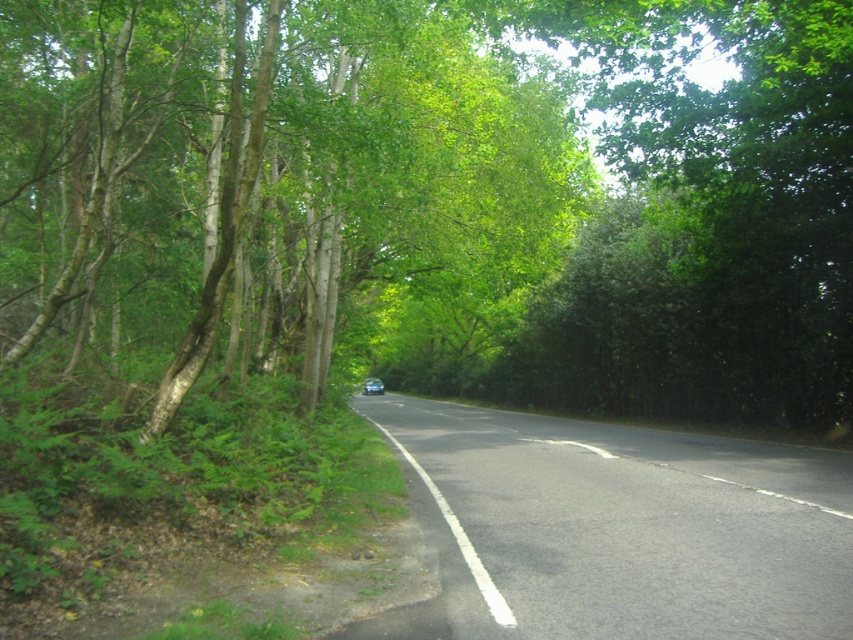
You are a pedestrian standing on the sidewalk next to the black asphalt road at center. You see a metallic blue car at center approaching from the distance. Which side of the road should you stand on to ensure safety?

The black asphalt road at center is to the right of the metallic blue car at center, so you should stand on the left side of the road to stay safe as the car approaches from the right side.

You are standing at the starting point of the road and want to reach the green leafy tree at center. Which direction should you walk to get there?

The green leafy tree at center is located at point (434,200), so you should walk towards the center of the road to reach it.

You are a pedestrian standing at the edge of the black asphalt road at center. You want to cross to the other side where there is a park. Which direction should you walk to avoid the green leafy tree at center?

The green leafy tree at center is on the left side of the black asphalt road at center. To avoid it, you should walk to the right side of the black asphalt road at center where there is no tree blocking the path.